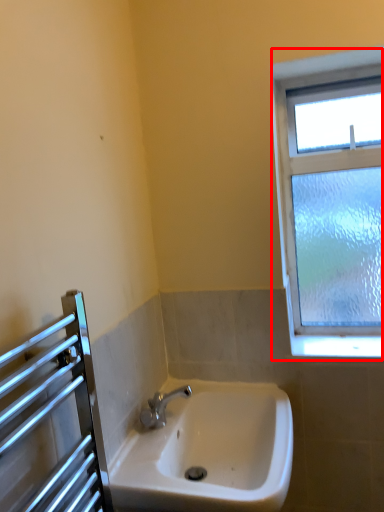
Question: Where is window (annotated by the red box) located in relation to sink in the image?

Choices:
 (A) left
 (B) right

Answer: (B)